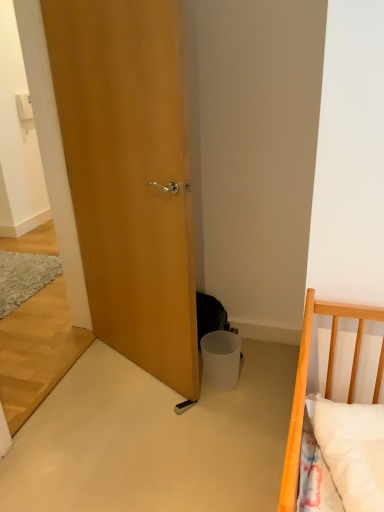
Question: Can you confirm if wooden door at center is smaller than white matte trash bin at lower center?

Choices:
 (A) yes
 (B) no

Answer: (B)

Question: Is the position of wooden door at center less distant than that of white matte trash bin at lower center?

Choices:
 (A) yes
 (B) no

Answer: (A)

Question: Is wooden door at center shorter than white matte trash bin at lower center?

Choices:
 (A) no
 (B) yes

Answer: (A)

Question: Can you confirm if wooden door at center is wider than white matte trash bin at lower center?

Choices:
 (A) yes
 (B) no

Answer: (B)

Question: Are wooden door at center and white matte trash bin at lower center located far from each other?

Choices:
 (A) yes
 (B) no

Answer: (B)

Question: From the image's perspective, would you say wooden door at center is shown under white matte trash bin at lower center?

Choices:
 (A) yes
 (B) no

Answer: (B)

Question: Considering the relative sizes of white matte trash bin at lower center and wooden door at center in the image provided, is white matte trash bin at lower center shorter than wooden door at center?

Choices:
 (A) yes
 (B) no

Answer: (A)

Question: Can you confirm if white matte trash bin at lower center is positioned to the right of wooden door at center?

Choices:
 (A) no
 (B) yes

Answer: (B)

Question: From a real-world perspective, is white matte trash bin at lower center positioned under wooden door at center based on gravity?

Choices:
 (A) no
 (B) yes

Answer: (B)

Question: Is white matte trash bin at lower center oriented towards wooden door at center?

Choices:
 (A) no
 (B) yes

Answer: (A)

Question: Does white matte trash bin at lower center lie in front of wooden door at center?

Choices:
 (A) no
 (B) yes

Answer: (A)

Question: Is white matte trash bin at lower center thinner than wooden door at center?

Choices:
 (A) yes
 (B) no

Answer: (B)

Question: Considering the relative positions of wooden door at center and white matte trash bin at lower center in the image provided, is wooden door at center to the left or to the right of white matte trash bin at lower center?

Choices:
 (A) right
 (B) left

Answer: (B)